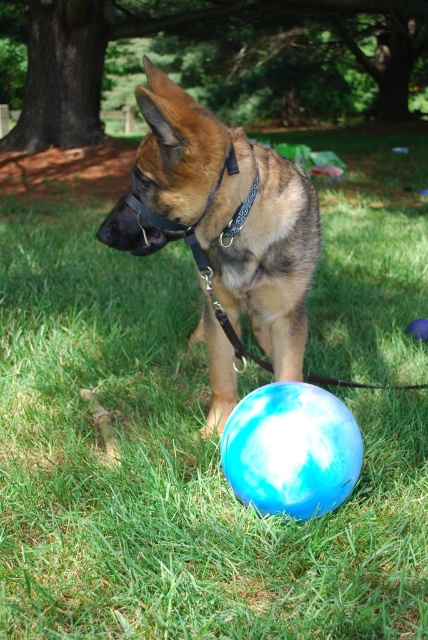
Between brown fur dog at center and blue glossy ball at center, which one is positioned lower?

Positioned lower is blue glossy ball at center.

Who is shorter, brown fur dog at center or blue glossy ball at center?

Standing shorter between the two is blue glossy ball at center.

Find the location of `brown fur dog at center`. brown fur dog at center is located at coordinates (232, 214).